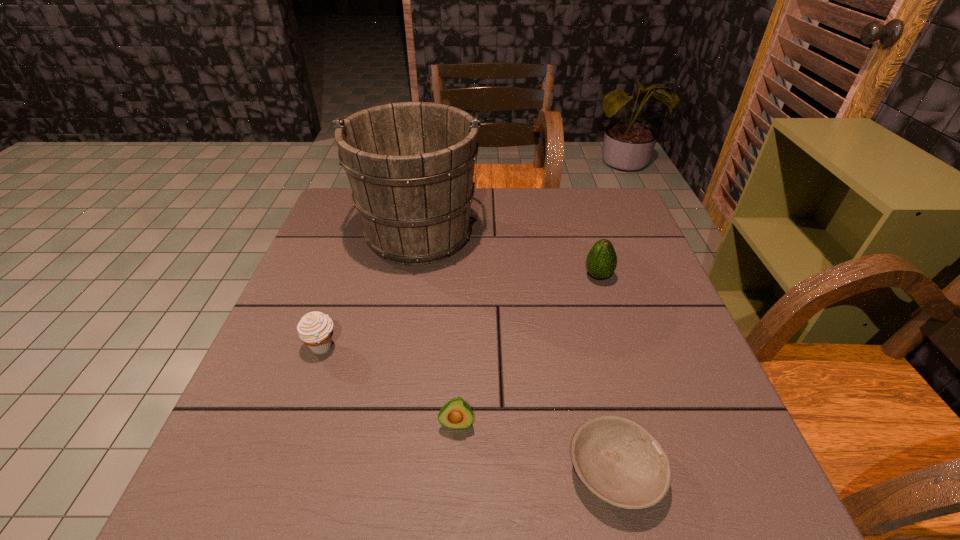
Where is `free spot between the taller avocado and the bucket`? free spot between the taller avocado and the bucket is located at coordinates (509, 254).

The image size is (960, 540). In order to click on vacant space that is in between the third nearest object and the farther avocado in this screenshot , I will do `click(460, 311)`.

Identify the location of free area in between the shorter avocado and the right avocado. Image resolution: width=960 pixels, height=540 pixels. (527, 350).

Locate an element on the screen. The height and width of the screenshot is (540, 960). free area in between the tallest object and the shortest object is located at coordinates (517, 352).

Image resolution: width=960 pixels, height=540 pixels. I want to click on the second closest object to the tallest object, so click(601, 262).

Find the location of a particular element. This screenshot has height=540, width=960. object that is the third closest one to the farther avocado is located at coordinates (456, 414).

The image size is (960, 540). I want to click on vacant position in the image that satisfies the following two spatial constraints: 1. on the front side of the bowl; 2. on the left side of the third farthest object, so point(278,472).